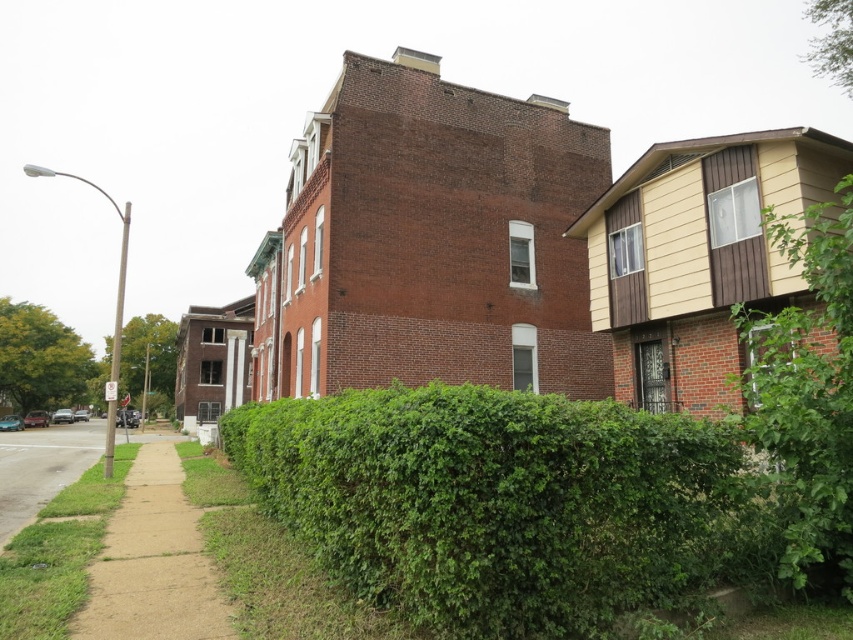
You are standing on the sidewalk in front of the buildings and want to walk to the green leafy bush at lower right. What direction should you move relative to your current position?

The green leafy bush at lower right is located at coordinates (807, 390), so you should move towards the lower right direction to reach it.